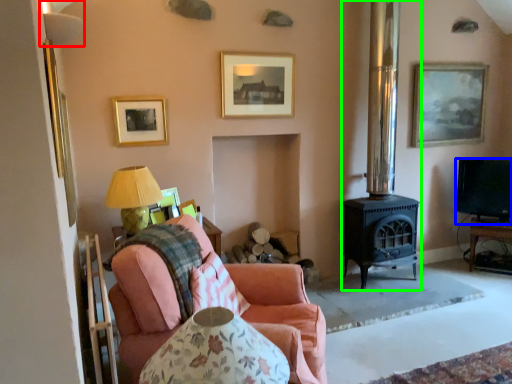
Question: Considering the real-world distances, which object is farthest from lamp (highlighted by a red box)? television (highlighted by a blue box) or fireplace (highlighted by a green box)?

Choices:
 (A) television
 (B) fireplace

Answer: (A)